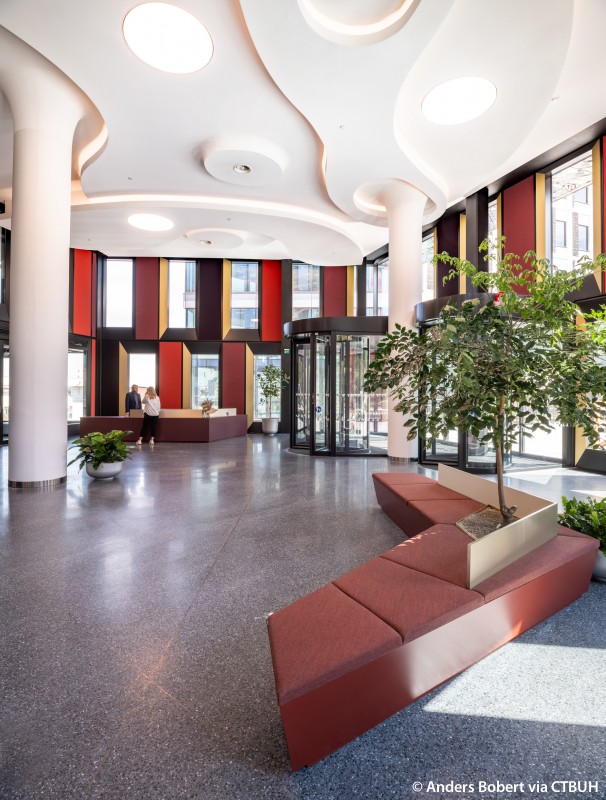
Locate an element on the screen. seat is located at coordinates (348, 654), (397, 606), (439, 558), (441, 514), (419, 480).